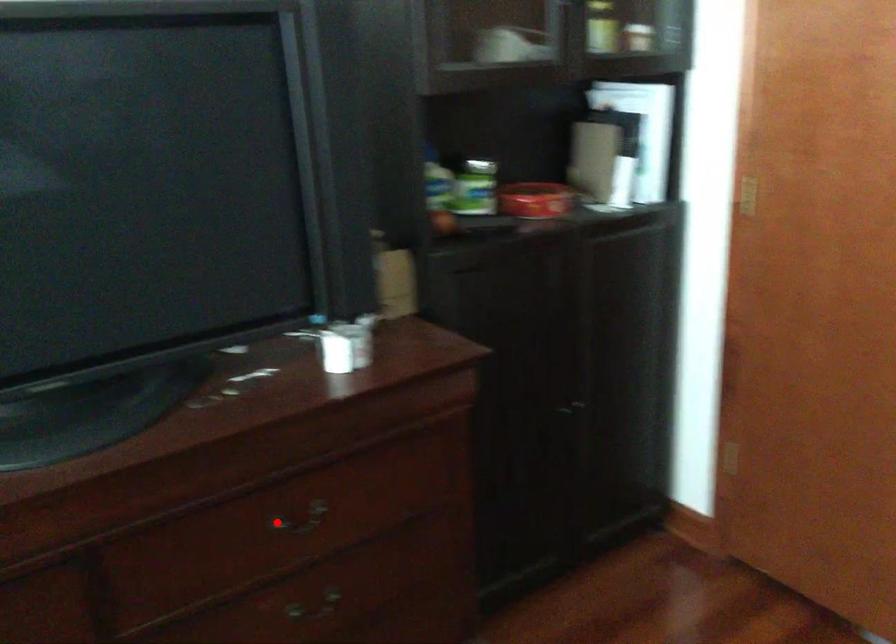
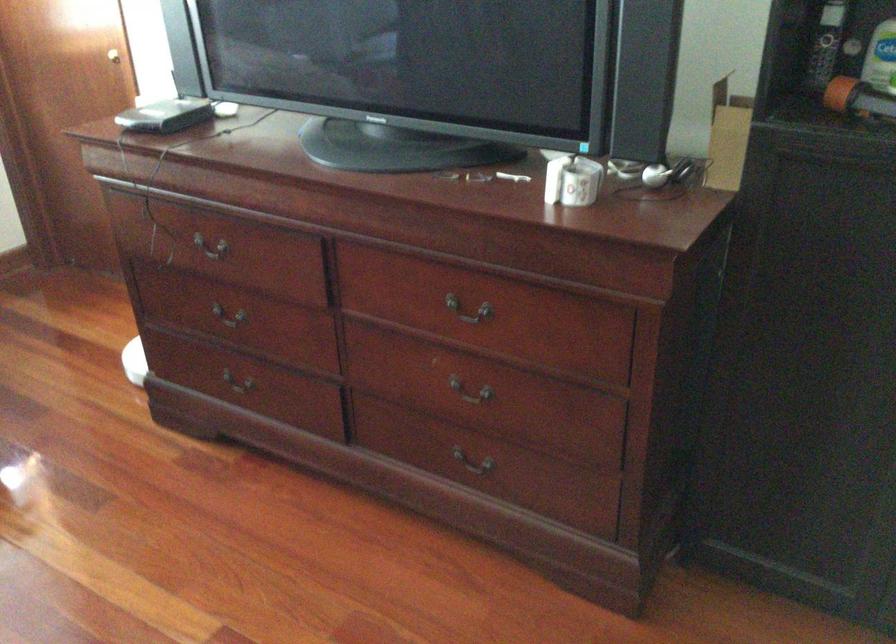
Question: A red point is marked in image1. In image2, is the corresponding 3D point closer to the camera or farther? Reply with the corresponding letter.

Choices:
 (A) The corresponding 3D point is closer.
 (B) The corresponding 3D point is farther.

Answer: (B)